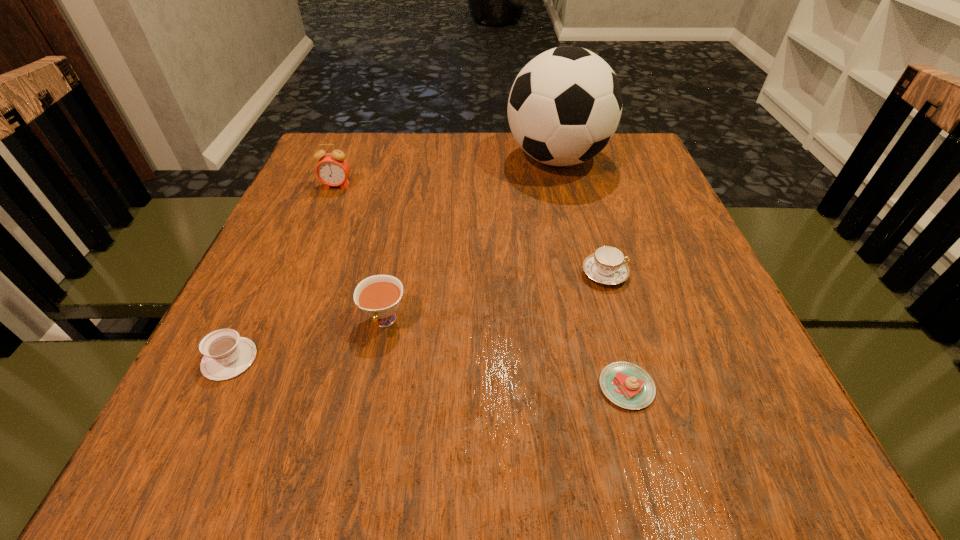
This screenshot has width=960, height=540. I want to click on free space located 0.130m on the side of the second teacup from right to left with the handle, so click(365, 417).

Locate an element on the screen. The image size is (960, 540). free space located on the side with the handle of the rightmost teacup is located at coordinates (676, 274).

The height and width of the screenshot is (540, 960). I want to click on vacant space located 0.090m on the right of the shortest object, so click(x=714, y=387).

You are a GUI agent. You are given a task and a screenshot of the screen. Output one action in this format:
    pyautogui.click(x=<x>, y=<y>)
    Task: Click on the object positioned at the far edge
    The image size is (960, 540).
    Given the screenshot: What is the action you would take?
    pyautogui.click(x=565, y=105)

This screenshot has width=960, height=540. I want to click on alarm clock at the left edge, so click(332, 169).

Identify the location of teacup located at the left edge. The height and width of the screenshot is (540, 960). (226, 355).

Where is `soccer ball that is at the right edge`? The image size is (960, 540). soccer ball that is at the right edge is located at coordinates pyautogui.click(x=565, y=105).

Where is `teacup present at the right edge`? This screenshot has height=540, width=960. teacup present at the right edge is located at coordinates (607, 266).

Find the location of a particular element. This screenshot has height=540, width=960. object present at the far right corner is located at coordinates (565, 105).

Image resolution: width=960 pixels, height=540 pixels. In order to click on vacant space at the far edge in this screenshot , I will do `click(441, 147)`.